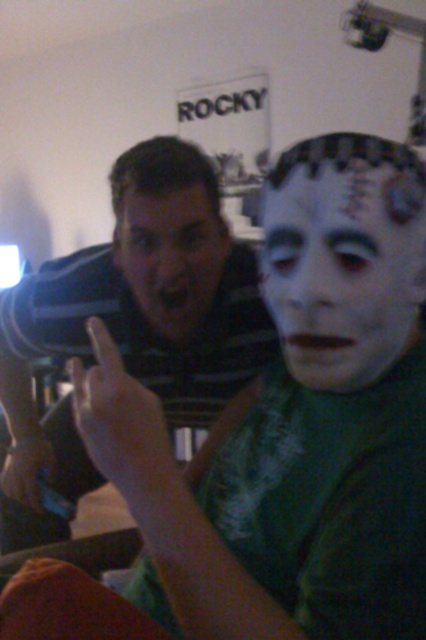
You are a photographer standing in front of the two people in the scene. You want to take a photo that includes both the striped shirt at center and the matte black face at center. Which object should you focus on first to ensure both are in clear focus?

The striped shirt at center is further to the viewer than the matte black face at center. To ensure both are in clear focus, you should focus on the striped shirt at center first, as it is closer to the camera, and the depth of field will naturally include the matte black face at center in the background.

You are standing in the room and notice two points marked in the image. Which point, point 1 at coordinates (x=135, y=280) or point 2 at coordinates (x=360, y=346), is closer to you?

Point 1 at coordinates (x=135, y=280) is closer to you because it is further to the viewer than point 2 at coordinates (x=360, y=346).

You are designing a social distancing poster and need to ensure that the two faces in the image are at least 6 feet apart. Based on the description, can the white matte face at center and the matte black face at center be placed exactly as shown in the image on the poster while meeting the social distancing requirement?

The white matte face at center and the matte black face at center are 13.72 inches apart from each other. Since 13.72 inches is less than 6 feet, which is 72 inches, the faces cannot be placed as shown and must be spaced further apart to meet the social distancing requirement.